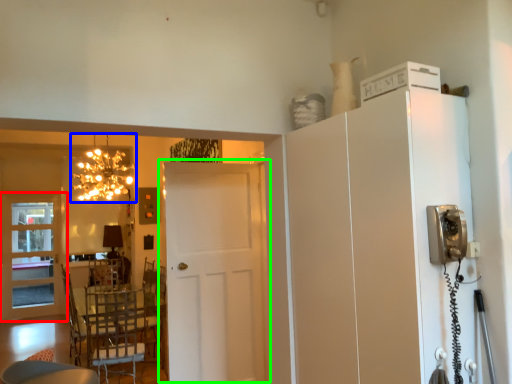
Question: Considering the real-world distances, which object is closest to door (highlighted by a red box)? lamp (highlighted by a blue box) or door (highlighted by a green box).

Choices:
 (A) lamp
 (B) door

Answer: (A)